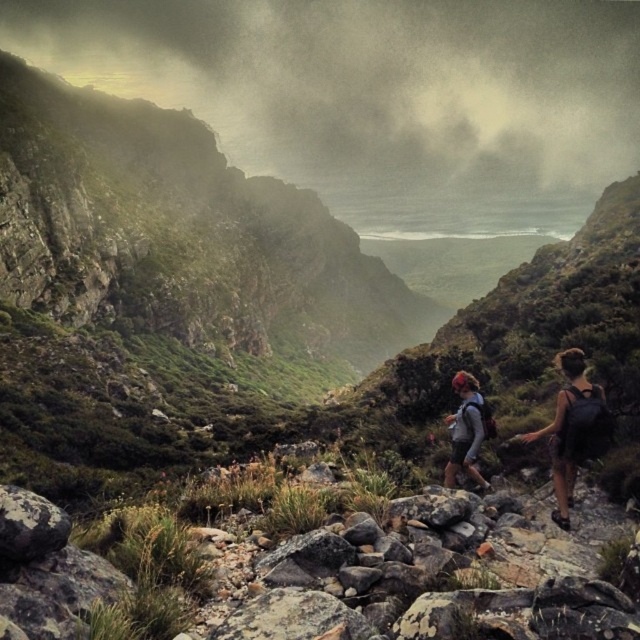
Question: Which point is farther from the camera taking this photo?

Choices:
 (A) (3, 540)
 (B) (602, 419)
 (C) (470, 461)

Answer: (C)

Question: Which of the following is the closest to the observer?

Choices:
 (A) (493, 428)
 (B) (572, 381)

Answer: (B)

Question: Is speckled gray rock at lower left smaller than matte gray jacket at center?

Choices:
 (A) no
 (B) yes

Answer: (A)

Question: Can you confirm if matte gray backpack at center is positioned to the left of speckled gray rock at lower left?

Choices:
 (A) yes
 (B) no

Answer: (B)

Question: Does speckled gray rock at lower left lie in front of matte gray jacket at center?

Choices:
 (A) no
 (B) yes

Answer: (B)

Question: Which point is closer to the camera?

Choices:
 (A) speckled gray rock at lower left
 (B) matte gray jacket at center
 (C) matte gray backpack at center

Answer: (A)